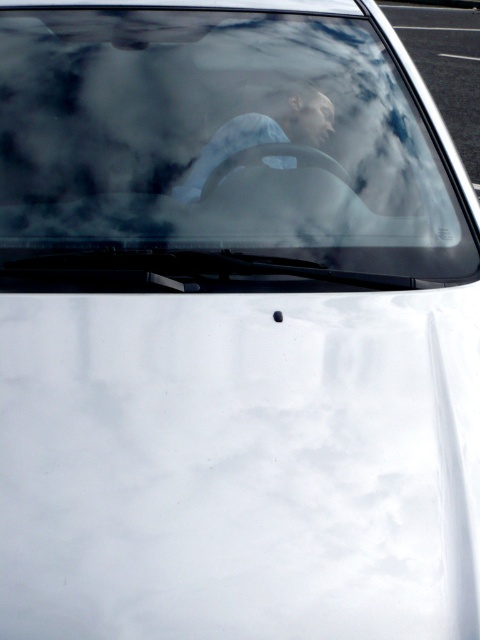
Who is positioned more to the left, transparent glass windshield at upper center or asphalt at upper right?

transparent glass windshield at upper center is more to the left.

Which is below, transparent glass windshield at upper center or asphalt at upper right?

transparent glass windshield at upper center is lower down.

What do you see at coordinates (219, 138) in the screenshot? I see `transparent glass windshield at upper center` at bounding box center [219, 138].

Locate an element on the screen. This screenshot has width=480, height=640. transparent glass windshield at upper center is located at coordinates (219, 138).

Does asphalt at upper right appear under blue fabric shirt at center?

Actually, asphalt at upper right is above blue fabric shirt at center.

Between asphalt at upper right and blue fabric shirt at center, which one appears on the right side from the viewer's perspective?

asphalt at upper right is more to the right.

At what (x,y) coordinates should I click in order to perform the action: click on asphalt at upper right. Please return your answer as a coordinate pair (x, y). Looking at the image, I should click on (445, 67).

You are a GUI agent. You are given a task and a screenshot of the screen. Output one action in this format:
    pyautogui.click(x=<x>, y=<y>)
    Task: Click on the asphalt at upper right
    The height and width of the screenshot is (640, 480).
    Given the screenshot: What is the action you would take?
    pyautogui.click(x=445, y=67)

Can you confirm if transparent glass windshield at upper center is wider than blue fabric shirt at center?

Correct, the width of transparent glass windshield at upper center exceeds that of blue fabric shirt at center.

Identify the location of transparent glass windshield at upper center. The image size is (480, 640). (219, 138).

The height and width of the screenshot is (640, 480). Find the location of `transparent glass windshield at upper center`. transparent glass windshield at upper center is located at coordinates (219, 138).